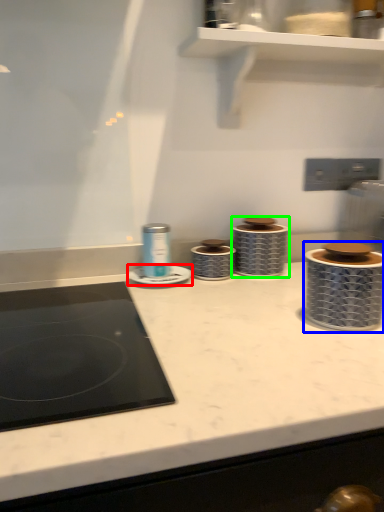
Question: Based on their relative distances, which object is farther from appliance (highlighted by a red box)? Choose from appliance (highlighted by a blue box) and appliance (highlighted by a green box).

Choices:
 (A) appliance
 (B) appliance

Answer: (A)